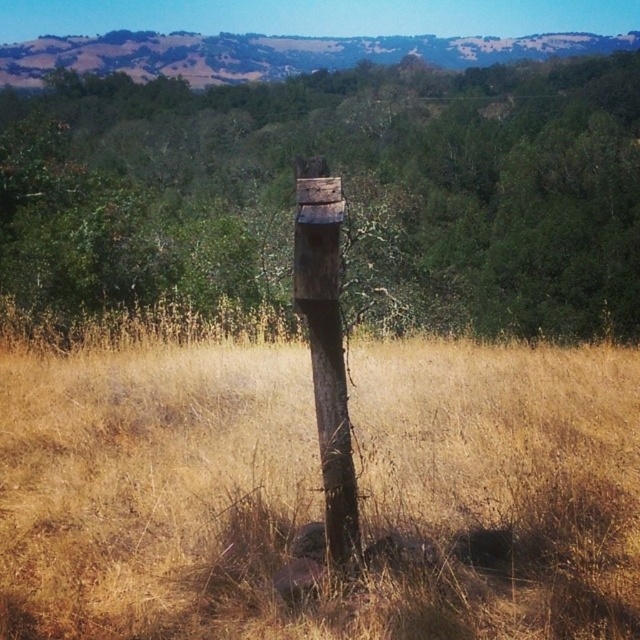
You are standing at the origin point of the coordinate system. You want to place a new decorative rock at the same location as the dry grass at center. What are the coordinates where you should place the rock?

The dry grass at center is located at coordinates point [310,484], so you should place the decorative rock at coordinates point [310,484].

You are a gardener who wants to plant a new flower bed between the dry grass at center and the weathered wood post at center. Which area should you choose to ensure the flowers have enough space to grow?

The dry grass at center is larger in size than the weathered wood post at center, so you should choose the area near the dry grass at center for the flower bed since it offers more space for the flowers to grow.

You are a small mouse trying to hide from a hawk flying above. You see the dry grass at center and the weathered wood post at center. Which location would provide better cover from the hawk?

The dry grass at center is positioned under weathered wood post at center, so the dry grass at center would provide better cover from the hawk as it is lower to the ground and less visible from above.